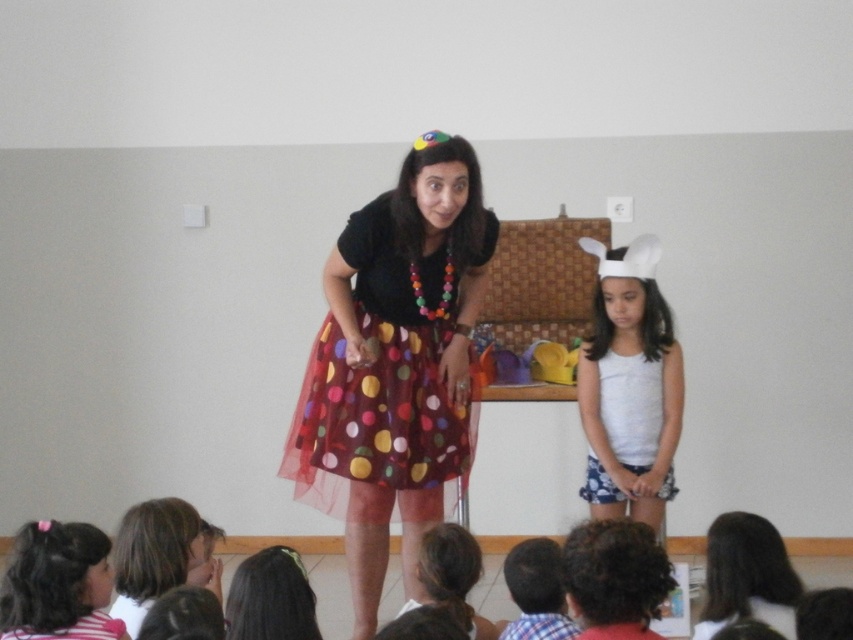
Does white matte tank top at center appear on the right side of curly hair at lower center?

Yes, white matte tank top at center is to the right of curly hair at lower center.

Measure the distance from white matte tank top at center to curly hair at lower center.

A distance of 1.56 meters exists between white matte tank top at center and curly hair at lower center.

At what (x,y) coordinates should I click in order to perform the action: click on white matte tank top at center. Please return your answer as a coordinate pair (x, y). This screenshot has height=640, width=853. Looking at the image, I should click on (630, 387).

Describe the element at coordinates (380, 380) in the screenshot. I see `polka dot tulle skirt at center` at that location.

Who is positioned more to the right, polka dot tulle skirt at center or white matte tank top at center?

Positioned to the right is white matte tank top at center.

Which is behind, point (492, 234) or point (606, 323)?

The point (606, 323) is behind.

Where is `polka dot tulle skirt at center`? The height and width of the screenshot is (640, 853). polka dot tulle skirt at center is located at coordinates (380, 380).

Is blonde hair at lower left closer to camera compared to plaid fabric shirt at lower center?

Yes, it is.

Which of these two, blonde hair at lower left or plaid fabric shirt at lower center, stands taller?

With more height is blonde hair at lower left.

Is point (128, 620) positioned in front of point (560, 560)?

Yes, it is.

Find the location of a particular element. blonde hair at lower left is located at coordinates (160, 556).